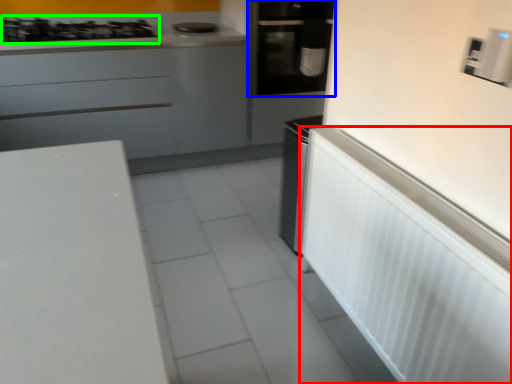
Question: Which object is the farthest from appliance (highlighted by a red box)? Choose among these: home appliance (highlighted by a blue box) or gas stove (highlighted by a green box).

Choices:
 (A) home appliance
 (B) gas stove

Answer: (B)